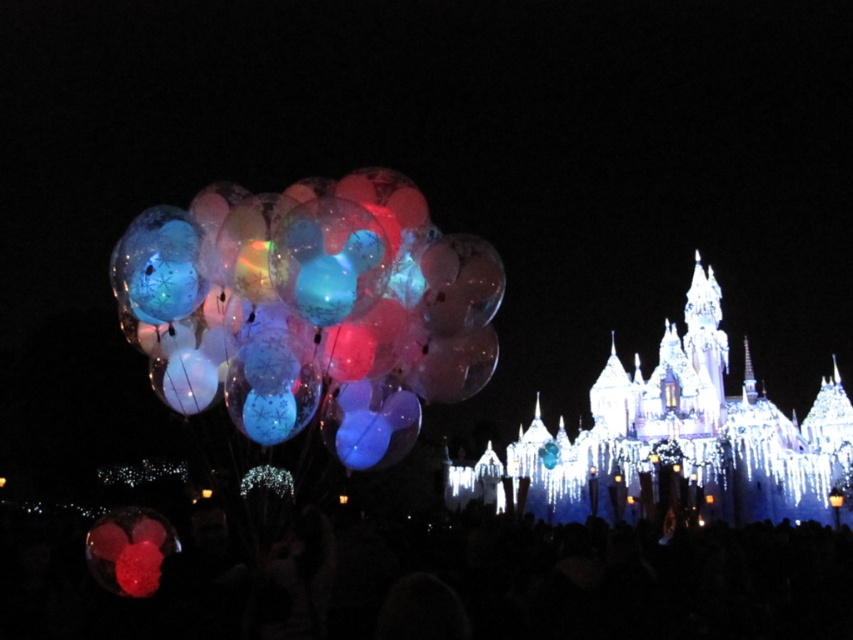
Is translucent plastic balloons at left smaller than illuminated glass castle at center?

Indeed, translucent plastic balloons at left has a smaller size compared to illuminated glass castle at center.

Is the position of translucent plastic balloons at left less distant than that of illuminated glass castle at center?

Yes, it is.

Who is more distant from viewer, (431, 291) or (830, 406)?

The point (830, 406) is more distant.

Find the location of `translucent plastic balloons at left`. translucent plastic balloons at left is located at coordinates (x=310, y=307).

Does illuminated castle at center have a greater width compared to translucent plastic balloons at left?

Yes, illuminated castle at center is wider than translucent plastic balloons at left.

Who is shorter, illuminated castle at center or translucent plastic balloons at left?

With less height is translucent plastic balloons at left.

Is point (421, 291) less distant than point (190, 292)?

No, (421, 291) is further to viewer.

Where is `illuminated castle at center`? The image size is (853, 640). illuminated castle at center is located at coordinates (291, 324).

Between illuminated castle at center and illuminated glass castle at center, which one appears on the right side from the viewer's perspective?

From the viewer's perspective, illuminated glass castle at center appears more on the right side.

Does illuminated castle at center lie in front of illuminated glass castle at center?

Yes, it is in front of illuminated glass castle at center.

This screenshot has height=640, width=853. I want to click on illuminated castle at center, so click(x=291, y=324).